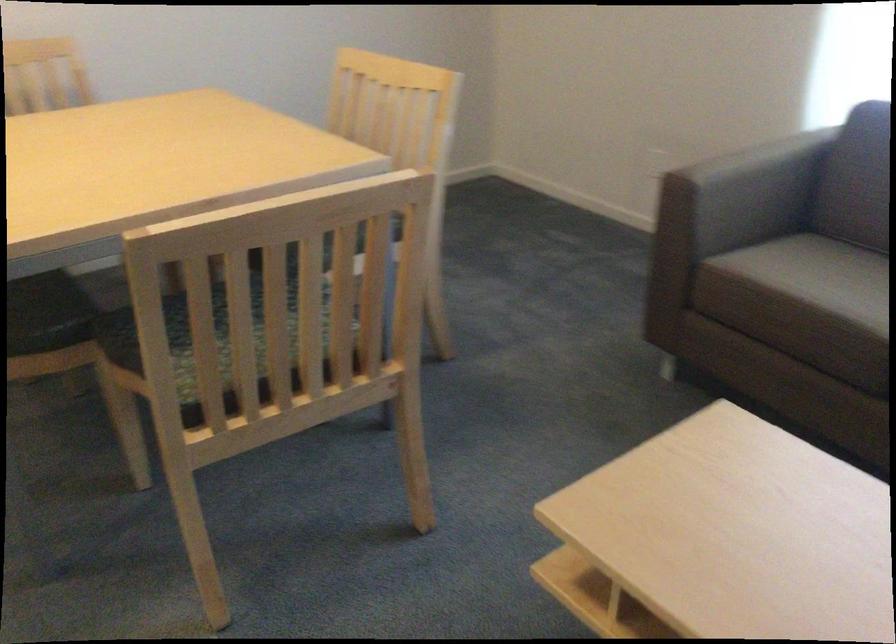
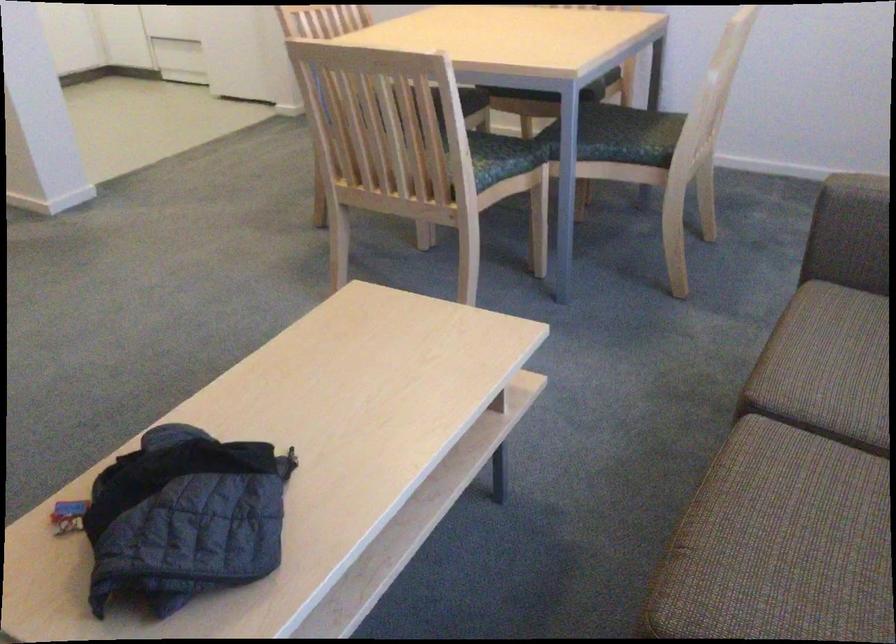
Question: I am providing you with two images of the same scene from different viewpoints. After the viewpoint changes to image2, which objects are now occluded?

Choices:
 (A) dark sofa sitting surface
 (B) green chair sitting surface
 (C) red first aid kit
 (D) grey sofa sitting surface

Answer: (A)